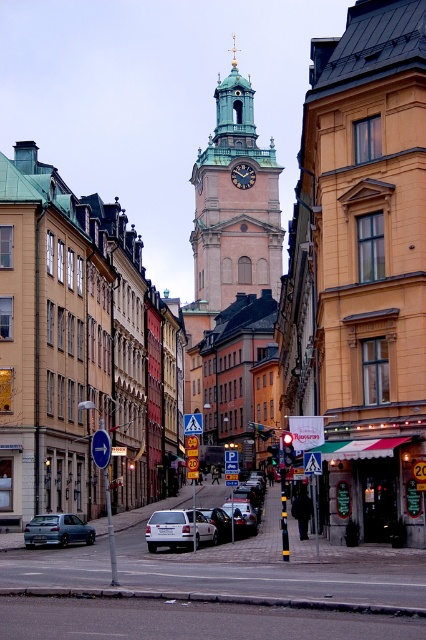
Does green stone clock tower at center come in front of blue plastic arrow at center?

No, it is behind blue plastic arrow at center.

The width and height of the screenshot is (426, 640). Describe the element at coordinates (235, 204) in the screenshot. I see `green stone clock tower at center` at that location.

Identify the location of green stone clock tower at center. The image size is (426, 640). click(235, 204).

Who is higher up, silver metallic car at center or dark brown wooden clock at center?

dark brown wooden clock at center is above.

Does silver metallic car at center appear over dark brown wooden clock at center?

No, silver metallic car at center is not above dark brown wooden clock at center.

What do you see at coordinates (218, 522) in the screenshot?
I see `silver metallic car at center` at bounding box center [218, 522].

Identify the location of silver metallic car at center. The image size is (426, 640). (218, 522).

At what (x,y) coordinates should I click in order to perform the action: click on green stone clock tower at center. Please return your answer as a coordinate pair (x, y). Looking at the image, I should click on (235, 204).

From the picture: Does green stone clock tower at center have a smaller size compared to blue plastic sign at left?

No, green stone clock tower at center is not smaller than blue plastic sign at left.

Who is more distant from viewer, [199,227] or [94,444]?

Point [199,227]

You are a GUI agent. You are given a task and a screenshot of the screen. Output one action in this format:
    pyautogui.click(x=<x>, y=<y>)
    Task: Click on the green stone clock tower at center
    
    Given the screenshot: What is the action you would take?
    pyautogui.click(x=235, y=204)